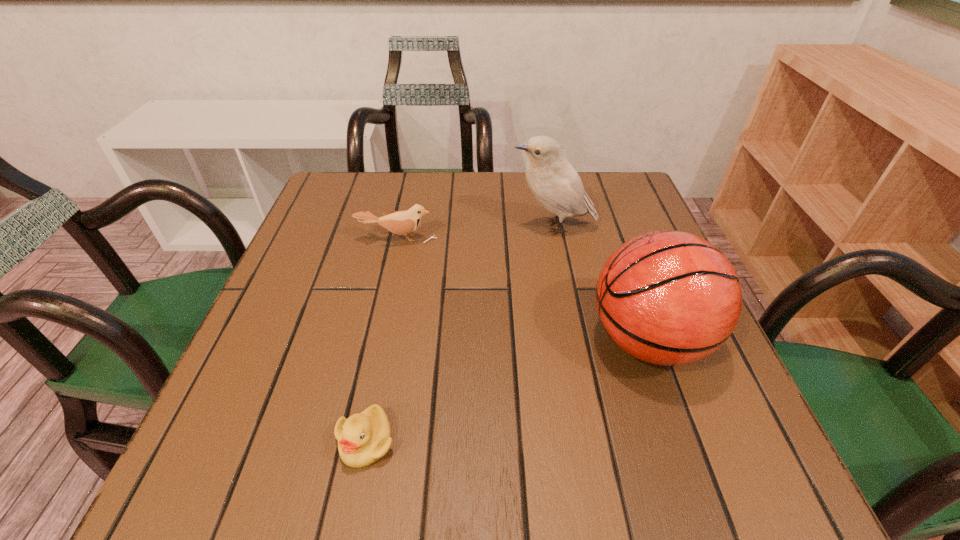
This screenshot has height=540, width=960. What are the coordinates of `the taller bird` in the screenshot? It's located at (555, 183).

What are the coordinates of `basketball` in the screenshot? It's located at (666, 297).

The image size is (960, 540). Identify the location of the shorter bird. (400, 222).

The image size is (960, 540). What are the coordinates of `the second shortest object` in the screenshot? It's located at (400, 222).

You are a GUI agent. You are given a task and a screenshot of the screen. Output one action in this format:
    pyautogui.click(x=<x>, y=<y>)
    Task: Click on the nearest object
    The height and width of the screenshot is (540, 960).
    Given the screenshot: What is the action you would take?
    pyautogui.click(x=363, y=438)

Image resolution: width=960 pixels, height=540 pixels. What are the coordinates of `the shortest object` in the screenshot? It's located at (363, 438).

The height and width of the screenshot is (540, 960). In order to click on vacant space located 0.220m at the beak of the taller bird in this screenshot , I will do `click(416, 227)`.

Find the location of a particular element. Image resolution: width=960 pixels, height=540 pixels. blank space located at the beak of the taller bird is located at coordinates (377, 227).

Identify the location of free region located 0.280m at the beak of the taller bird. The image size is (960, 540). (391, 227).

I want to click on vacant space situated on the side with spill of the third farthest object, so click(519, 340).